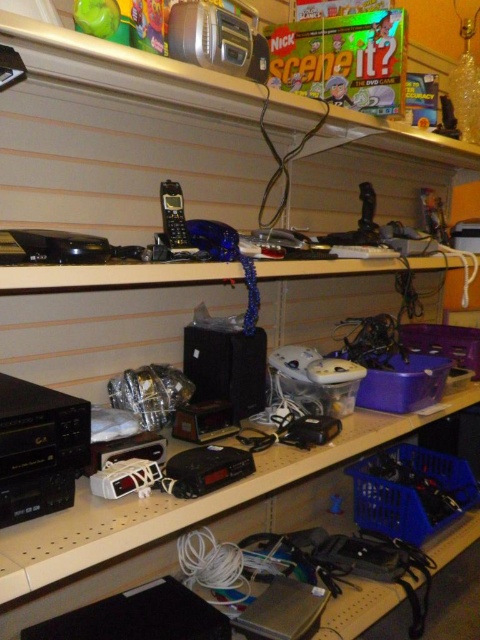
You are organizing the shelves and need to access the matte black phone at center. Is the black plastic clock at center blocking your direct line of sight to it?

Yes, the black plastic clock at center is in front of the matte black phone at center, so it is blocking the direct line of sight.

You are an organizer trying to fit a new rectangular box that is 10 cm wide into the space between the black plastic speaker at center and the metallic silver radio at upper center. Based on their widths, will there be enough space for the box?

The black plastic speaker at center is wider than the metallic silver radio at upper center. Since the box is 10 cm wide, the total width required would be the sum of both objects plus the box. However, without knowing the exact widths of the speaker and radio, it is impossible to determine if there is sufficient space.

You are standing in front of the shelving unit and want to reach both the point at coordinates point [202,490] and point [177,248]. Which point will you need to stretch your arm further to reach?

Point [177,248] requires stretching your arm further because it is farther from the camera compared to point [202,490].